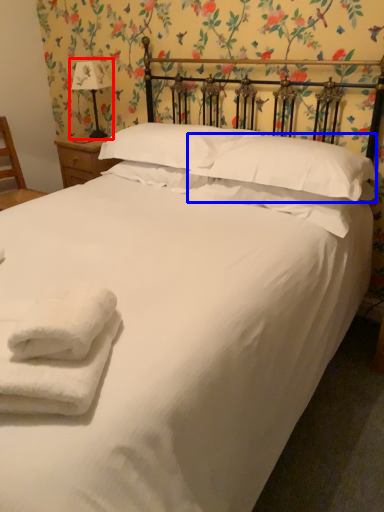
Question: Which object is further to the camera taking this photo, table lamp (highlighted by a red box) or pillow (highlighted by a blue box)?

Choices:
 (A) table lamp
 (B) pillow

Answer: (A)